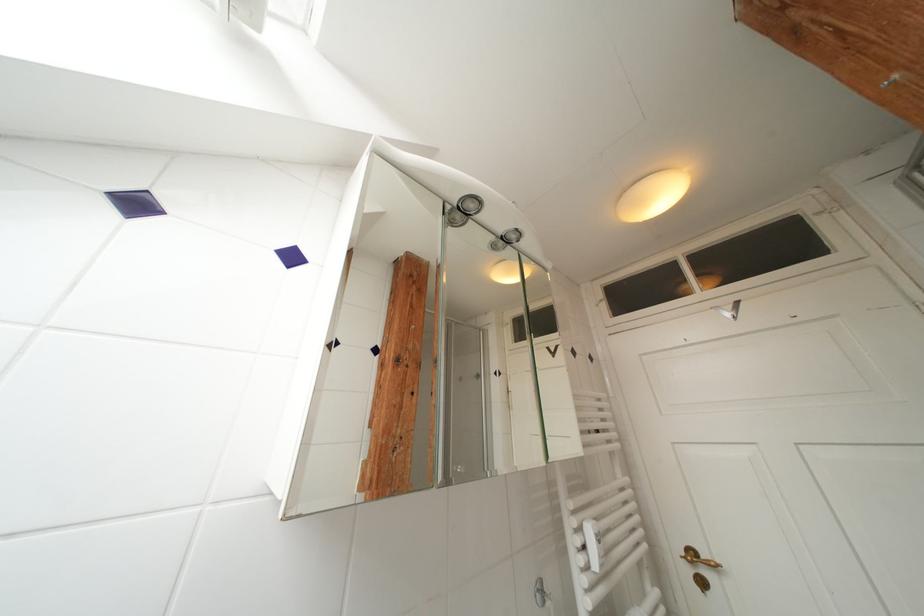
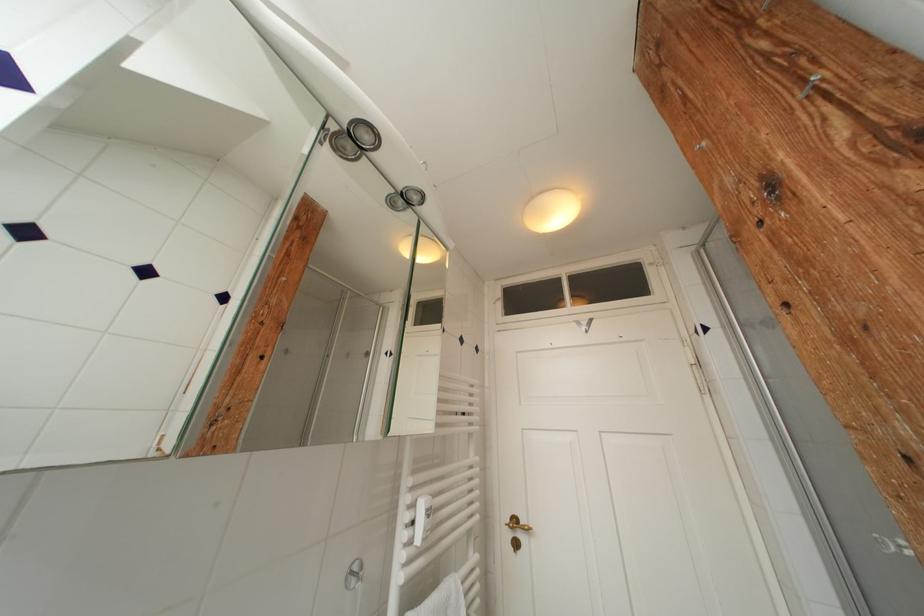
Question: What movement of the cameraman would produce the second image?

Choices:
 (A) Left
 (B) Right
 (C) Forward
 (D) Backward

Answer: (B)